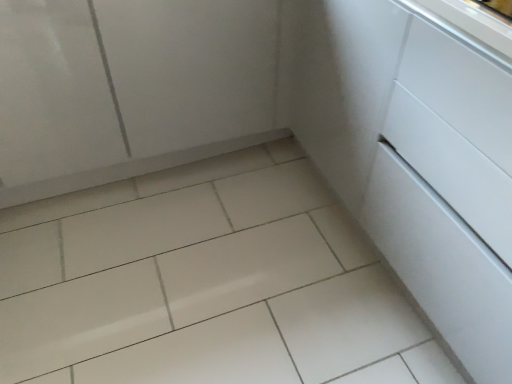
Question: Does white glossy drawer at center-right have a greater height compared to white glossy tile at center?

Choices:
 (A) yes
 (B) no

Answer: (A)

Question: Is white glossy drawer at center-right to the right of white glossy tile at center from the viewer's perspective?

Choices:
 (A) no
 (B) yes

Answer: (B)

Question: Is white glossy drawer at center-right positioned beyond the bounds of white glossy tile at center?

Choices:
 (A) yes
 (B) no

Answer: (A)

Question: Can you confirm if white glossy drawer at center-right is smaller than white glossy tile at center?

Choices:
 (A) yes
 (B) no

Answer: (B)

Question: From a real-world perspective, is white glossy drawer at center-right positioned under white glossy tile at center based on gravity?

Choices:
 (A) no
 (B) yes

Answer: (A)

Question: Is white glossy drawer at center-right to the left of white glossy tile at center from the viewer's perspective?

Choices:
 (A) yes
 (B) no

Answer: (B)

Question: From a real-world perspective, is white glossy tile at center located higher than white glossy cabinet at upper left?

Choices:
 (A) no
 (B) yes

Answer: (A)

Question: From the image's perspective, is white glossy tile at center on top of white glossy cabinet at upper left?

Choices:
 (A) no
 (B) yes

Answer: (A)

Question: Can you confirm if white glossy tile at center is taller than white glossy cabinet at upper left?

Choices:
 (A) yes
 (B) no

Answer: (B)

Question: Is white glossy tile at center touching white glossy cabinet at upper left?

Choices:
 (A) no
 (B) yes

Answer: (A)

Question: Does white glossy tile at center have a lesser height compared to white glossy cabinet at upper left?

Choices:
 (A) no
 (B) yes

Answer: (B)

Question: From a real-world perspective, is white glossy tile at center below white glossy cabinet at upper left?

Choices:
 (A) yes
 (B) no

Answer: (A)

Question: Is white glossy cabinet at upper left smaller than white glossy tile at center?

Choices:
 (A) no
 (B) yes

Answer: (A)